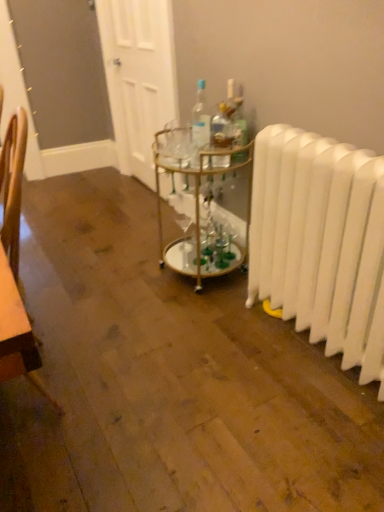
Question: In which direction should I rotate to look at clear glass bottle at center, which appears as the second bottle when viewed from the right?

Choices:
 (A) left
 (B) right

Answer: (B)

Question: Considering the relative sizes of gold metallic bar cart at center and white plastic radiator at right in the image provided, is gold metallic bar cart at center taller than white plastic radiator at right?

Choices:
 (A) yes
 (B) no

Answer: (B)

Question: Does gold metallic bar cart at center have a greater width compared to white plastic radiator at right?

Choices:
 (A) yes
 (B) no

Answer: (A)

Question: Is gold metallic bar cart at center touching white plastic radiator at right?

Choices:
 (A) yes
 (B) no

Answer: (B)

Question: Is gold metallic bar cart at center positioned far away from white plastic radiator at right?

Choices:
 (A) no
 (B) yes

Answer: (A)

Question: Is gold metallic bar cart at center shorter than white plastic radiator at right?

Choices:
 (A) no
 (B) yes

Answer: (B)

Question: Could you tell me if gold metallic bar cart at center is turned towards white plastic radiator at right?

Choices:
 (A) no
 (B) yes

Answer: (A)

Question: Are white plastic radiator at right and translucent glass bottle at center, the 3th bottle when ordered from left to right, making contact?

Choices:
 (A) yes
 (B) no

Answer: (B)

Question: Can you confirm if white plastic radiator at right is positioned to the right of translucent glass bottle at center, the 1th bottle positioned from the right?

Choices:
 (A) no
 (B) yes

Answer: (B)

Question: Is white plastic radiator at right in front of translucent glass bottle at center, the 3th bottle when ordered from left to right?

Choices:
 (A) yes
 (B) no

Answer: (A)

Question: Is translucent glass bottle at center, the 3th bottle when ordered from left to right, at the back of white plastic radiator at right?

Choices:
 (A) yes
 (B) no

Answer: (B)

Question: From the image's perspective, does white plastic radiator at right appear higher than translucent glass bottle at center, the 1th bottle positioned from the right?

Choices:
 (A) no
 (B) yes

Answer: (A)

Question: Is white plastic radiator at right outside translucent glass bottle at center, the 3th bottle when ordered from left to right?

Choices:
 (A) no
 (B) yes

Answer: (B)

Question: From the image's perspective, is clear glass bottle at center, which ranks as the third bottle in right-to-left order, under translucent glass bottle at center, the 3th bottle when ordered from left to right?

Choices:
 (A) no
 (B) yes

Answer: (A)